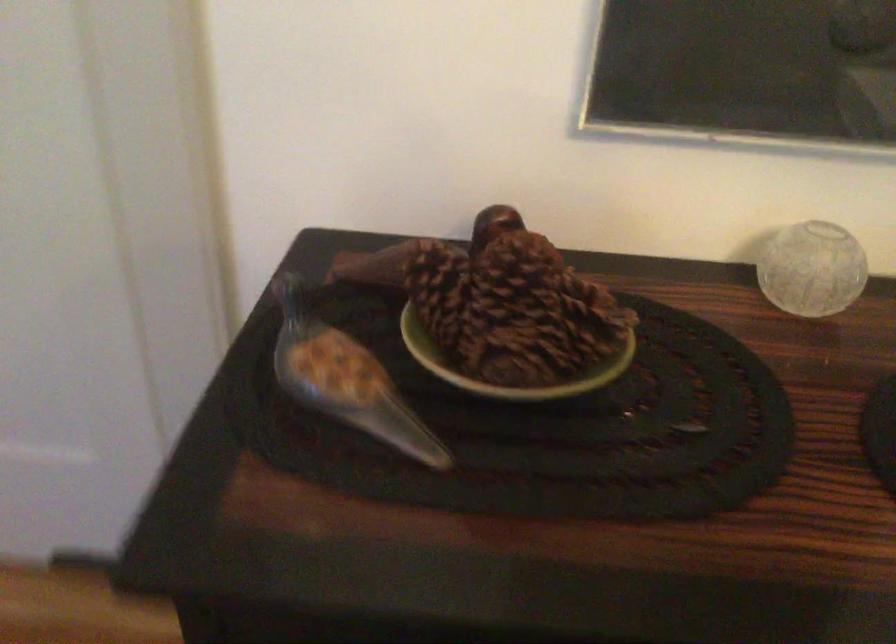
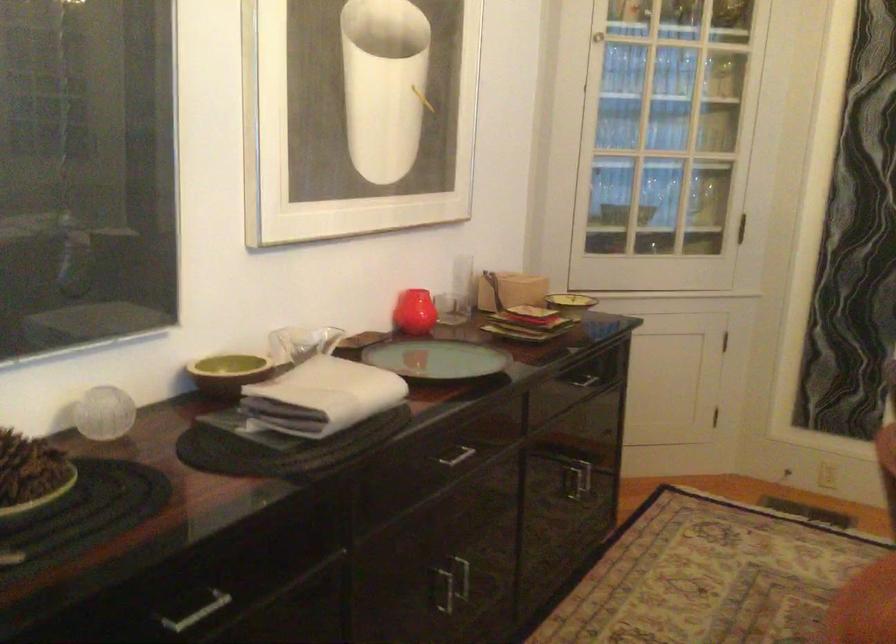
Where in the second image is the point corresponding to the point at 513,352 from the first image?

(30, 475)